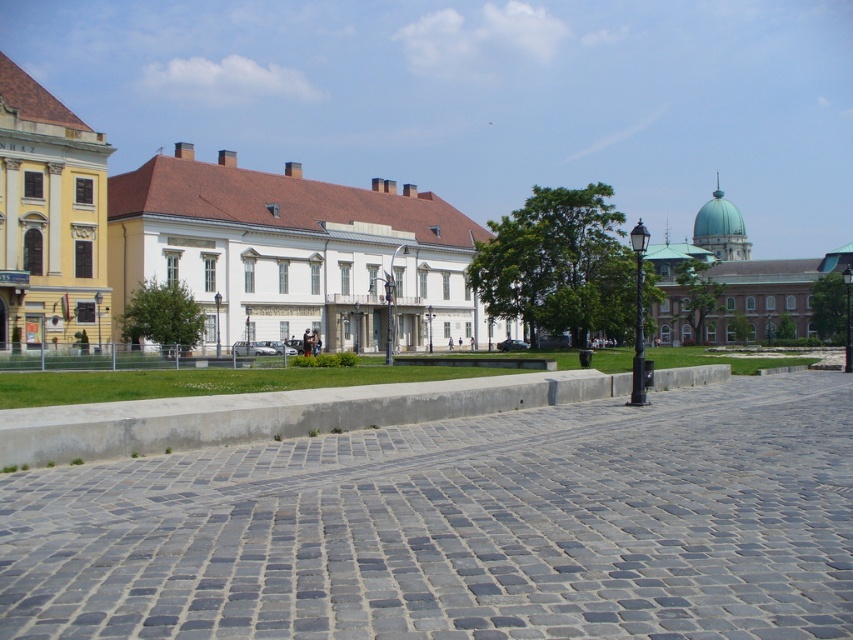
Question: Is gray cobblestone pavement at center bigger than teal dome building at upper right?

Choices:
 (A) yes
 (B) no

Answer: (B)

Question: Which object is closer to the camera taking this photo?

Choices:
 (A) teal dome building at upper right
 (B) gray cobblestone pavement at center
 (C) white smooth building at center
 (D) yellow matte building at left

Answer: (B)

Question: Does white smooth building at center have a greater width compared to yellow matte building at left?

Choices:
 (A) no
 (B) yes

Answer: (B)

Question: Among these points, which one is farthest from the camera?

Choices:
 (A) (842, 268)
 (B) (267, 214)
 (C) (51, 198)
 (D) (782, 472)

Answer: (A)

Question: Which object is positioned farthest from the yellow matte building at left?

Choices:
 (A) white smooth building at center
 (B) gray cobblestone pavement at center
 (C) teal dome building at upper right

Answer: (C)

Question: Is gray cobblestone pavement at center above white smooth building at center?

Choices:
 (A) no
 (B) yes

Answer: (A)